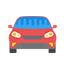
Where is `lights`? lights is located at coordinates (14, 36).